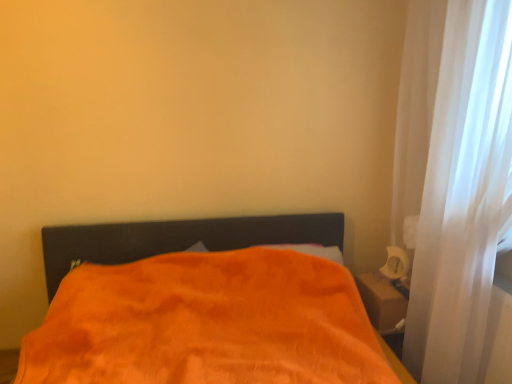
Question: Considering the relative positions of white glossy table lamp at right and orange plush blanket at center in the image provided, is white glossy table lamp at right behind orange plush blanket at center?

Choices:
 (A) no
 (B) yes

Answer: (B)

Question: Is white glossy table lamp at right beside orange plush blanket at center?

Choices:
 (A) yes
 (B) no

Answer: (B)

Question: Is white glossy table lamp at right looking in the opposite direction of orange plush blanket at center?

Choices:
 (A) yes
 (B) no

Answer: (B)

Question: Does white glossy table lamp at right have a larger size compared to orange plush blanket at center?

Choices:
 (A) no
 (B) yes

Answer: (A)

Question: Does white glossy table lamp at right have a greater width compared to orange plush blanket at center?

Choices:
 (A) no
 (B) yes

Answer: (A)

Question: From the image's perspective, is white glossy table lamp at right above orange plush blanket at center?

Choices:
 (A) yes
 (B) no

Answer: (A)

Question: Is white sheer curtain at right at the left side of orange plush blanket at center?

Choices:
 (A) yes
 (B) no

Answer: (B)

Question: Can you confirm if white sheer curtain at right is wider than orange plush blanket at center?

Choices:
 (A) yes
 (B) no

Answer: (B)

Question: Considering the relative positions of white sheer curtain at right and orange plush blanket at center in the image provided, is white sheer curtain at right in front of orange plush blanket at center?

Choices:
 (A) no
 (B) yes

Answer: (A)

Question: Does white sheer curtain at right have a smaller size compared to orange plush blanket at center?

Choices:
 (A) yes
 (B) no

Answer: (A)

Question: Does white sheer curtain at right have a larger size compared to orange plush blanket at center?

Choices:
 (A) no
 (B) yes

Answer: (A)

Question: Is white sheer curtain at right placed right next to orange plush blanket at center?

Choices:
 (A) yes
 (B) no

Answer: (B)

Question: Considering the relative sizes of orange plush blanket at center and white glossy table lamp at right in the image provided, is orange plush blanket at center shorter than white glossy table lamp at right?

Choices:
 (A) no
 (B) yes

Answer: (A)